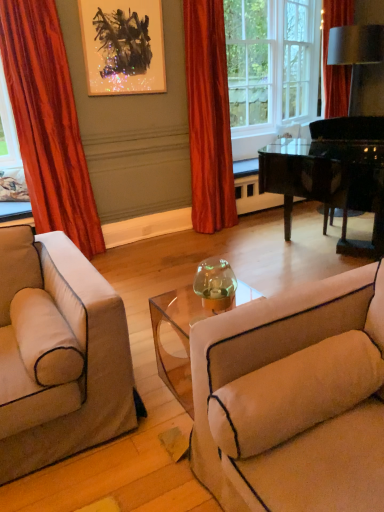
Question: From the image's perspective, is black glossy piano at center right positioned above or below silky orange curtain at center, which is the 1th curtain from right to left?

Choices:
 (A) below
 (B) above

Answer: (A)

Question: Is black glossy piano at center right inside or outside of silky orange curtain at center, acting as the 2th curtain starting from the left?

Choices:
 (A) inside
 (B) outside

Answer: (B)

Question: Based on their relative distances, which object is farther from the velvet orange curtain at left, the second curtain from the right?

Choices:
 (A) metallic abstract art at upper center
 (B) silky orange curtain at center, acting as the 2th curtain starting from the left
 (C) white glass window frame at upper center
 (D) beige fabric couch at lower right
 (E) black glossy piano at center right

Answer: (C)

Question: Which is farther from the white glass window frame at upper center?

Choices:
 (A) metallic abstract art at upper center
 (B) velvet orange curtain at left, acting as the first curtain starting from the left
 (C) beige fabric couch at lower right
 (D) black glossy piano at center right
 (E) silky orange curtain at center, acting as the 2th curtain starting from the left

Answer: (C)